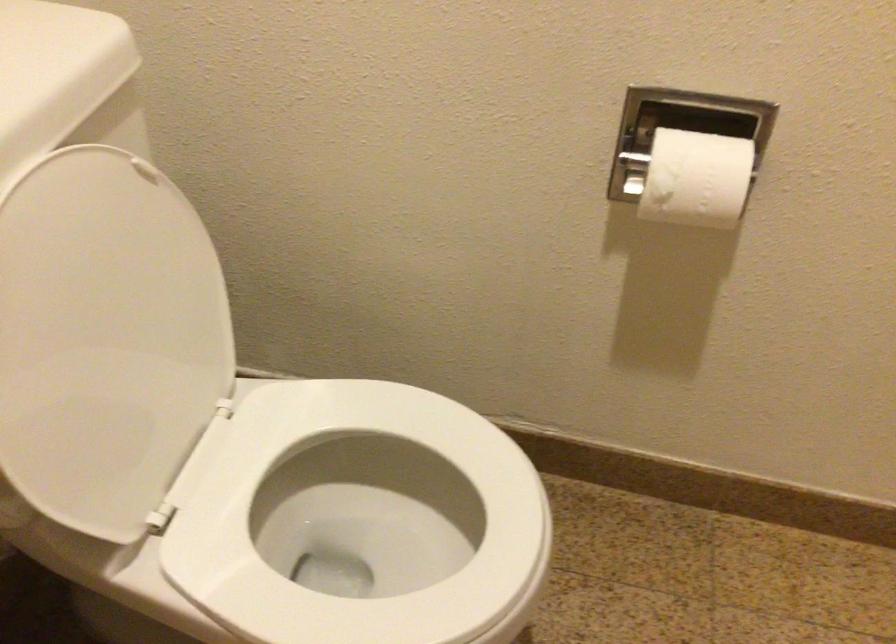
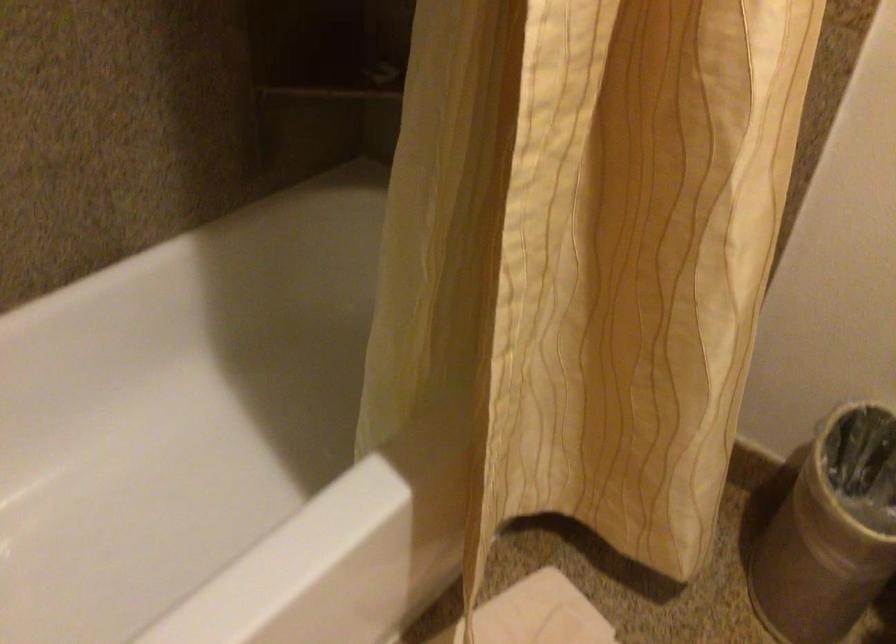
First-person continuous shooting, in which direction is the camera rotating?

The camera's rotation is toward left-down.